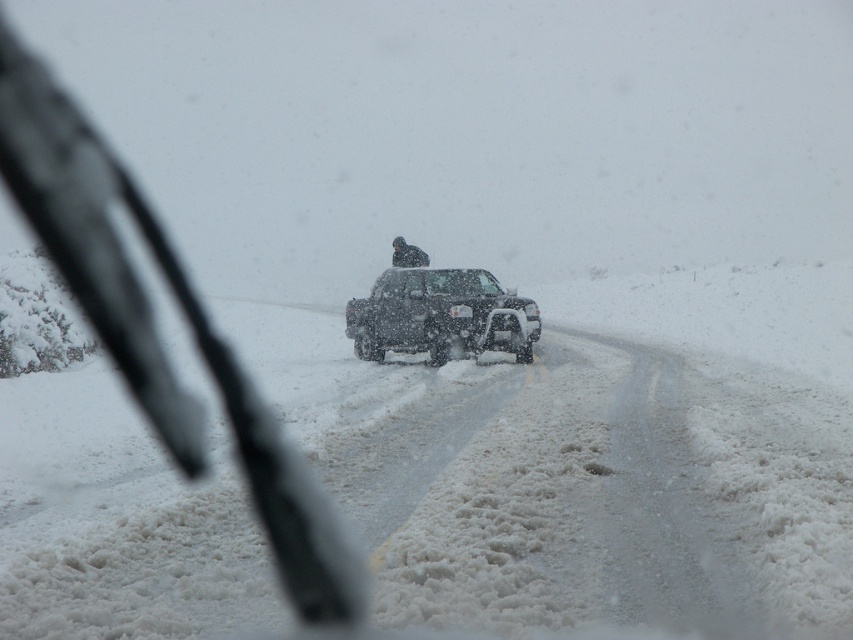
Question: Among these points, which one is farthest from the camera?

Choices:
 (A) (20, 93)
 (B) (463, 278)
 (C) (405, 244)

Answer: (A)

Question: Among these points, which one is nearest to the camera?

Choices:
 (A) (500, 305)
 (B) (415, 259)
 (C) (337, 605)

Answer: (C)

Question: Does transparent glass windshield at center have a lesser width compared to snow-covered black truck at center?

Choices:
 (A) no
 (B) yes

Answer: (A)

Question: Can you confirm if snow-covered black truck at center is wider than dark gray fabric jacket at center?

Choices:
 (A) yes
 (B) no

Answer: (A)

Question: Where is transparent glass windshield at center located in relation to snow-covered black truck at center in the image?

Choices:
 (A) left
 (B) right

Answer: (A)

Question: Which of the following is the farthest from the observer?

Choices:
 (A) (376, 312)
 (B) (407, 250)
 (C) (143, 355)

Answer: (B)